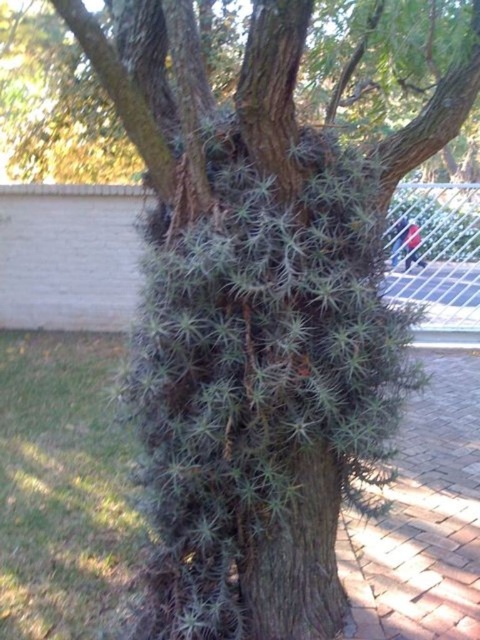
Based on the photo, does green spiky plant at center have a smaller size compared to metallic chain-link fence at upper center?

Yes.

Which is more to the left, green spiky plant at center or metallic chain-link fence at upper center?

metallic chain-link fence at upper center

Between point (240, 544) and point (66, 188), which one is positioned in front?

Point (240, 544) is in front.

Locate an element on the screen. green spiky plant at center is located at coordinates (295, 547).